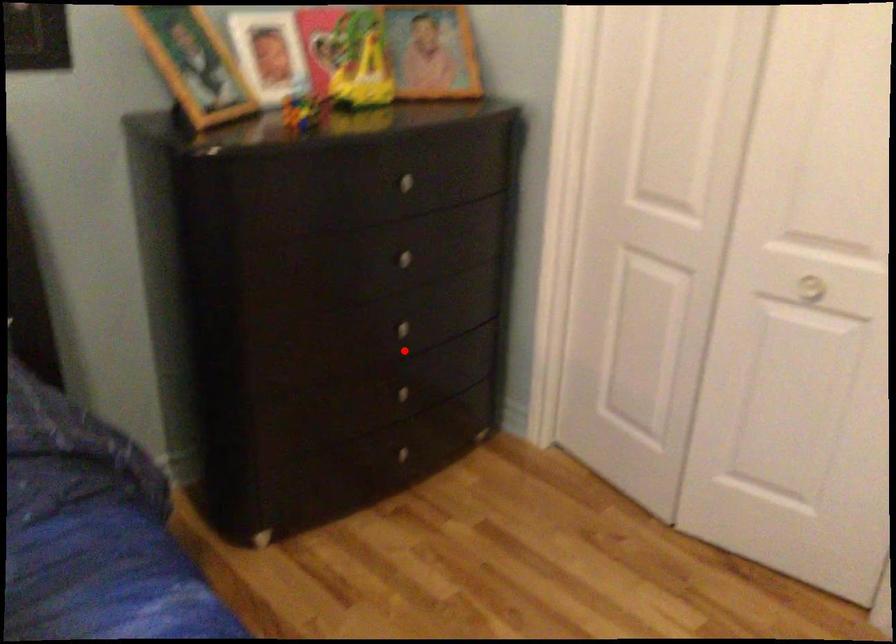
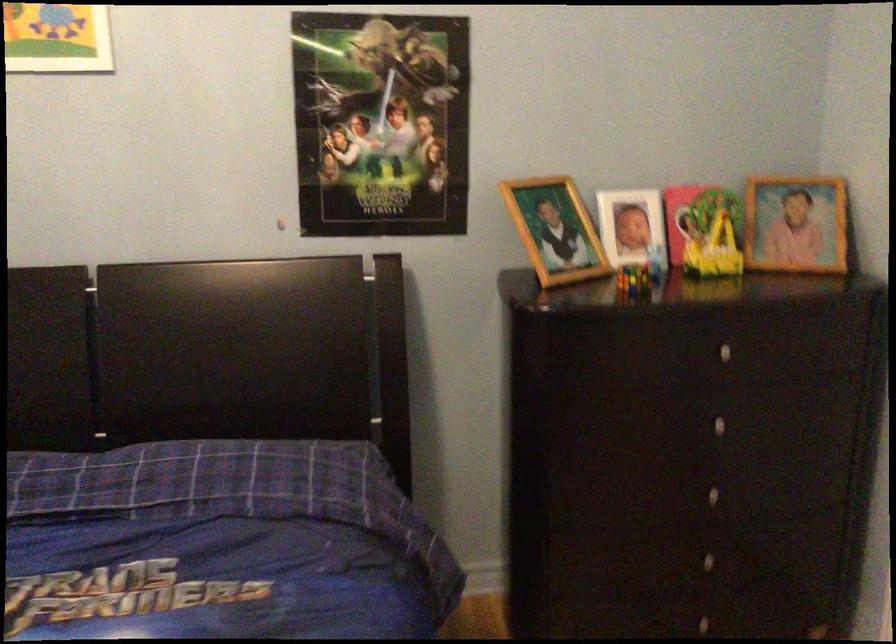
Find the pixel in the second image that matches the highlighted location in the first image.

(711, 516)